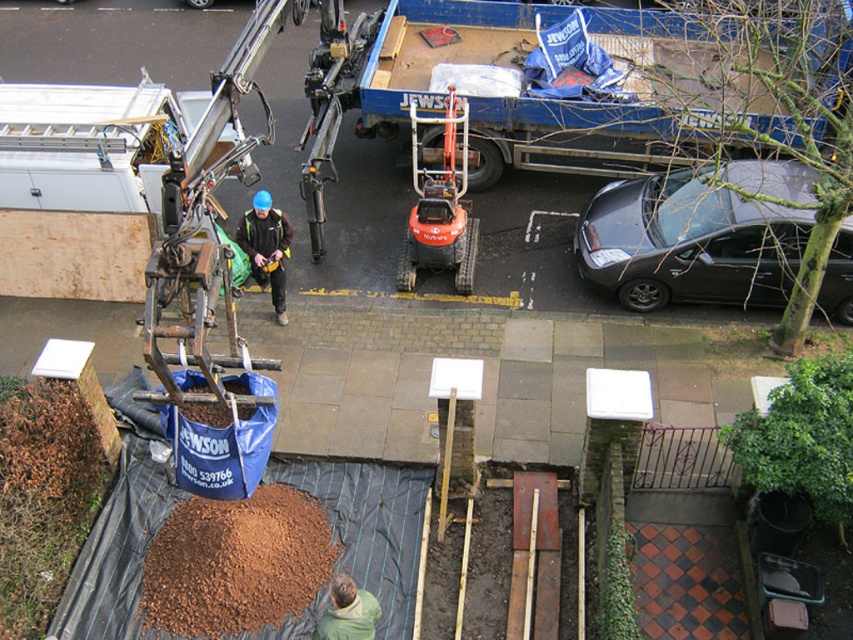
You are a delivery person needing to park your vehicle in this construction area. The shiny black car at right and the orange rubberized compact tractor at center are already present. Which vehicle should you park closer to if you want to be near the tractor but avoid the car?

You should park closer to the orange rubberized compact tractor at center since the shiny black car at right is already positioned to its right, keeping you near the tractor while avoiding proximity to the car.

You are a delivery person trying to access the orange rubberized compact tractor at center. There is a shiny black car at right blocking the path. Can you move around the car to reach the tractor?

The shiny black car at right is in front of orange rubberized compact tractor at center, so you can move around the car to reach the tractor as long as there is space on either side of the car.